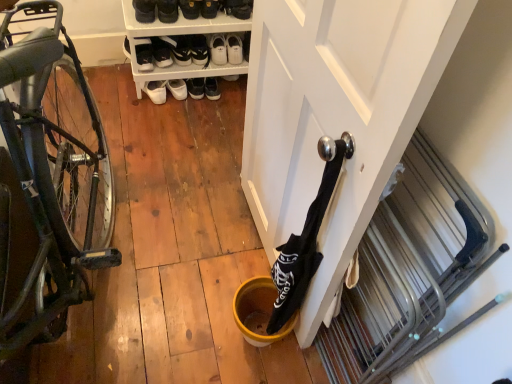
Question: Is yellow matte bucket at lower center to the left or to the right of shiny black bicycle at left in the image?

Choices:
 (A) left
 (B) right

Answer: (B)

Question: Choose the correct answer: Is yellow matte bucket at lower center inside shiny black bicycle at left or outside it?

Choices:
 (A) inside
 (B) outside

Answer: (B)

Question: Considering the real-world distances, which object is closest to the white leather sneakers at upper center, arranged as the sixth footwear when viewed from the left?

Choices:
 (A) white leather sneakers at upper center, the third footwear when ordered from right to left
 (B) yellow matte bucket at lower center
 (C) white leather shoes at center, which is counted as the first footwear, starting from the left
 (D) white matte door at center
 (E) black fabric wine bottle at center

Answer: (A)

Question: Based on their relative distances, which object is farther from the white matte door at center?

Choices:
 (A) white leather sneakers at upper center, arranged as the sixth footwear when viewed from the left
 (B) white plastic shoe rack at upper center
 (C) white leather sneakers at upper center, placed as the fifth footwear when sorted from left to right
 (D) yellow matte bucket at lower center
 (E) black suede shoe at upper center, placed as the third footwear when sorted from left to right

Answer: (E)